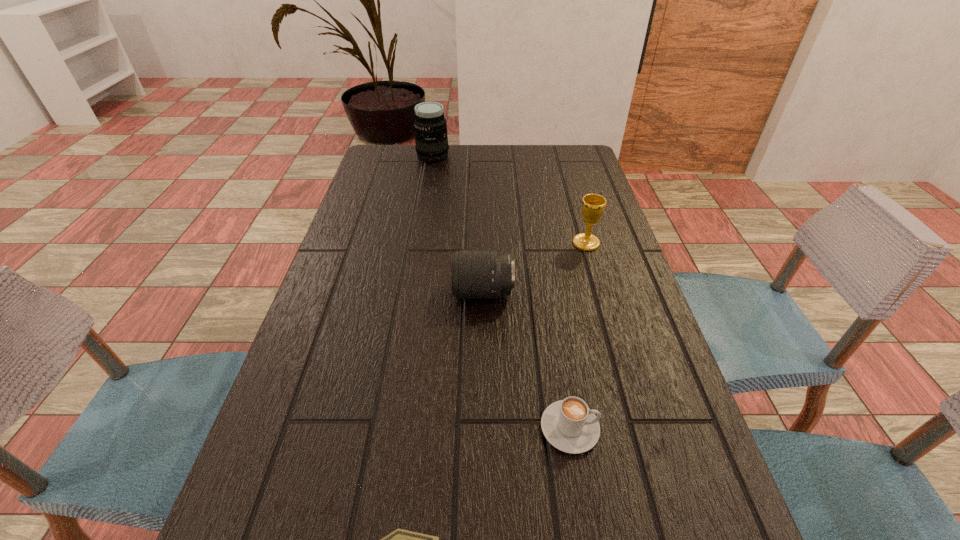
Find the location of a particular element. The width and height of the screenshot is (960, 540). free spot located on the surface of the third tallest object is located at coordinates (357, 293).

You are a GUI agent. You are given a task and a screenshot of the screen. Output one action in this format:
    pyautogui.click(x=<x>, y=<y>)
    Task: Click on the blank area located 0.190m on the surface of the third tallest object
    The height and width of the screenshot is (540, 960).
    Given the screenshot: What is the action you would take?
    pyautogui.click(x=370, y=293)

Locate an element on the screen. free space located on the surface of the third tallest object is located at coordinates (325, 293).

This screenshot has width=960, height=540. Find the location of `free region located to the right of the cappuccino`. free region located to the right of the cappuccino is located at coordinates (645, 428).

You are a GUI agent. You are given a task and a screenshot of the screen. Output one action in this format:
    pyautogui.click(x=<x>, y=<y>)
    Task: Click on the object situated at the far edge
    
    Given the screenshot: What is the action you would take?
    pyautogui.click(x=431, y=139)

This screenshot has width=960, height=540. Identify the location of object situated at the left edge. (431, 139).

The image size is (960, 540). Identify the location of chalice located in the right edge section of the desktop. 593,205.

Locate an element on the screen. cappuccino positioned at the right edge is located at coordinates (569, 425).

This screenshot has height=540, width=960. Find the location of `object positioned at the far left corner`. object positioned at the far left corner is located at coordinates (431, 139).

Find the location of `vacant area at the far edge of the desktop`. vacant area at the far edge of the desktop is located at coordinates (451, 160).